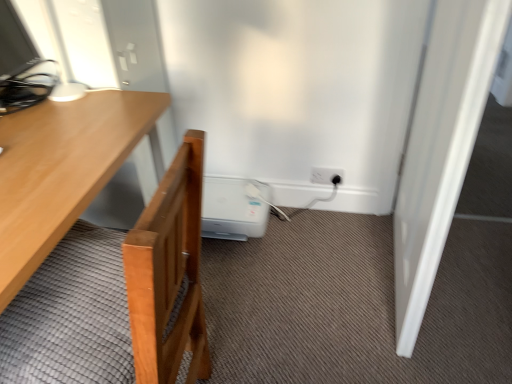
Where is `vacant area to the left of white smooth door at right`? Image resolution: width=512 pixels, height=384 pixels. vacant area to the left of white smooth door at right is located at coordinates (302, 286).